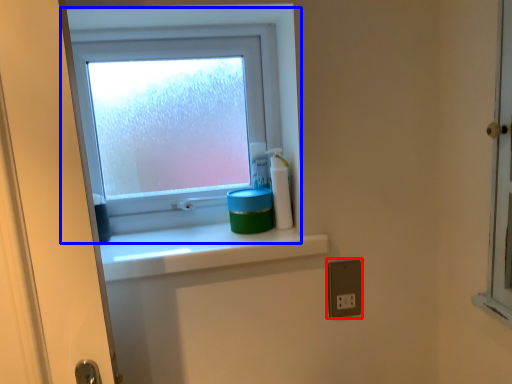
Question: Which object is closer to the camera taking this photo, electric outlet (highlighted by a red box) or window (highlighted by a blue box)?

Choices:
 (A) electric outlet
 (B) window

Answer: (A)